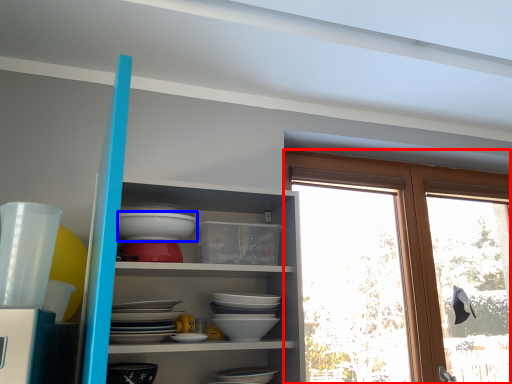
Question: Among these objects, which one is farthest to the camera, window (highlighted by a red box) or bowl (highlighted by a blue box)?

Choices:
 (A) window
 (B) bowl

Answer: (A)